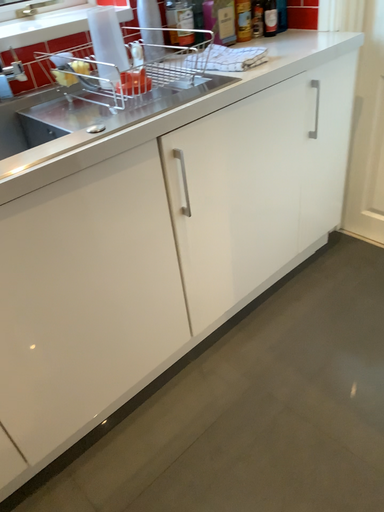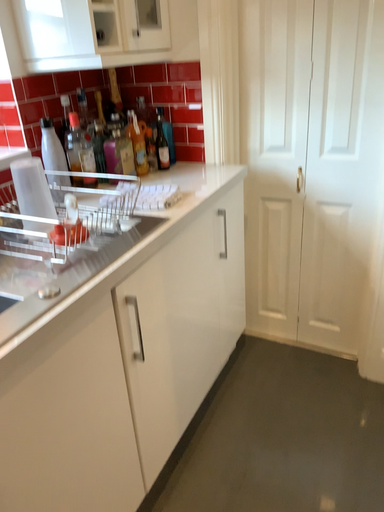
Question: Which way did the camera rotate in the video?

Choices:
 (A) rotated right
 (B) rotated left

Answer: (A)